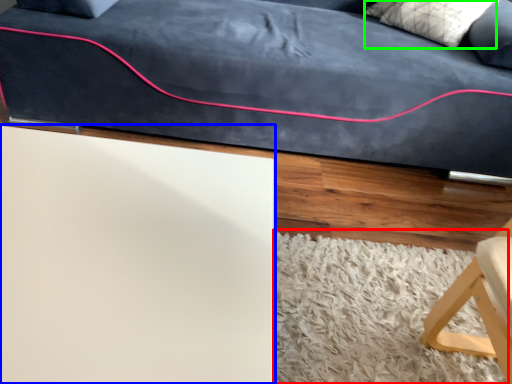
Question: Which is farther away from mat (highlighted by a red box)? table (highlighted by a blue box) or pillow (highlighted by a green box)?

Choices:
 (A) table
 (B) pillow

Answer: (B)